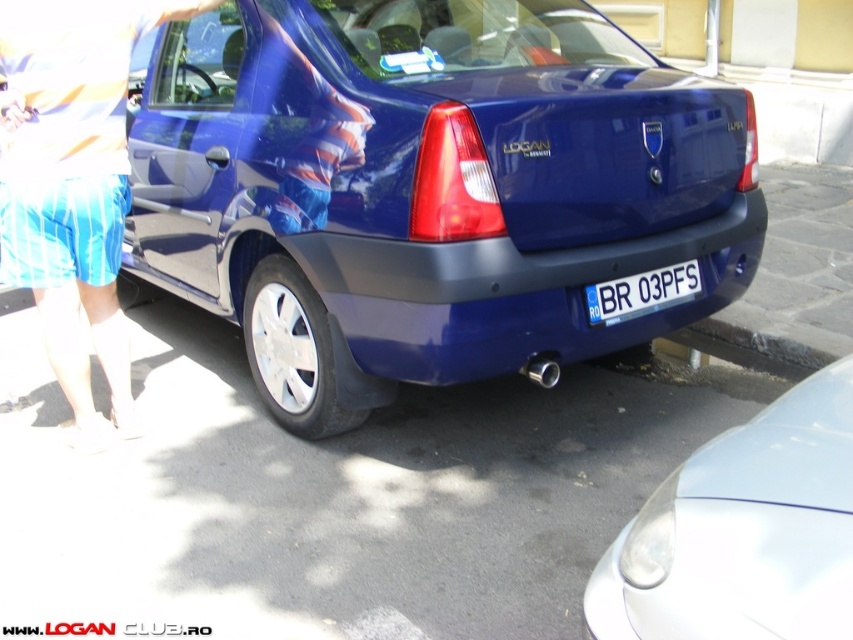
You are a pedestrian standing on the sidewalk and looking at the blue striped shorts at lower left and the white plastic license plate at center. Which object is closer to you?

The blue striped shorts at lower left is closer to you because it is further to the viewer than the white plastic license plate at center.

You are a pedestrian standing in front of the blue Dacia Logan and looking at the car. You notice the blue striped shorts at lower left and the white plastic license plate at center. Which object is closer to the bottom edge of the image?

The blue striped shorts at lower left is positioned over the white plastic license plate at center, so the blue striped shorts at lower left is closer to the bottom edge of the image.

You are a pedestrian standing on the sidewalk next to the blue Dacia Logan. You notice the blue striped shorts at lower left and the white plastic license plate at center. Which object is higher up in the image?

The blue striped shorts at lower left is much taller than the white plastic license plate at center, so the blue striped shorts at lower left is higher up in the image.